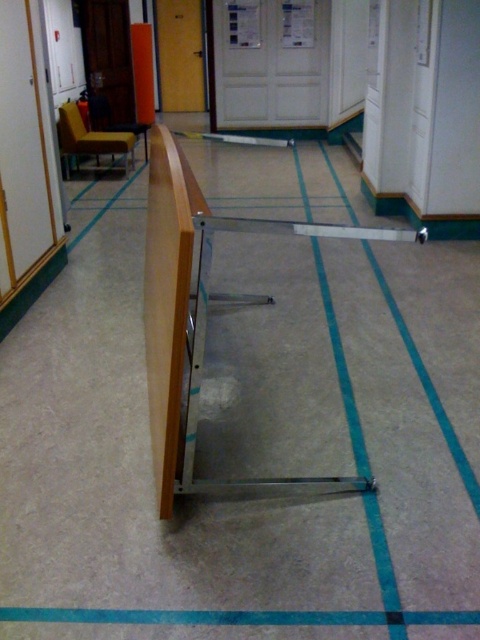
Does point (414, 230) come closer to viewer compared to point (340, 614)?

Yes.

Who is lower down, wooden rail at center or blue fabric strip at lower center?

blue fabric strip at lower center is below.

This screenshot has width=480, height=640. Find the location of `wooden rail at center`. wooden rail at center is located at coordinates (200, 312).

The width and height of the screenshot is (480, 640). Find the location of `wooden rail at center`. wooden rail at center is located at coordinates (200, 312).